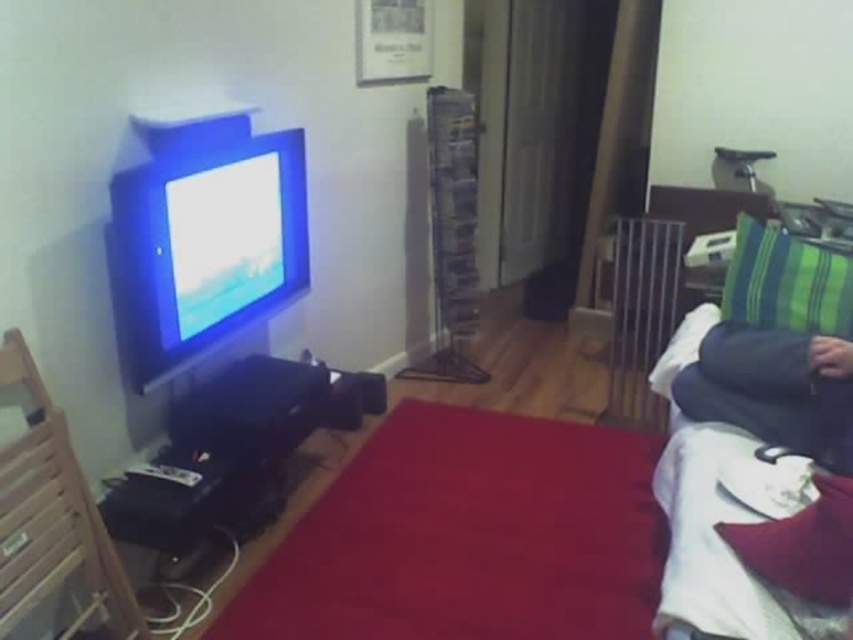
Does wooden armchair at left appear under green striped pillow at right?

Correct, wooden armchair at left is located below green striped pillow at right.

Where is `wooden armchair at left`? Image resolution: width=853 pixels, height=640 pixels. wooden armchair at left is located at coordinates (51, 515).

In order to click on wooden armchair at left in this screenshot , I will do `click(51, 515)`.

Can you confirm if wooden armchair at left is positioned above dark blue fabric at right?

Actually, wooden armchair at left is below dark blue fabric at right.

Between point (125, 632) and point (735, 364), which one is positioned behind?

The point (735, 364) is more distant.

Which is in front, point (13, 506) or point (773, 364)?

Point (13, 506)

Locate an element on the screen. Image resolution: width=853 pixels, height=640 pixels. wooden armchair at left is located at coordinates (51, 515).

Does point (741, 227) come closer to viewer compared to point (833, 586)?

No.

Does green striped pillow at right have a lesser width compared to velvet red pillow at lower right?

No, green striped pillow at right is not thinner than velvet red pillow at lower right.

Identify the location of green striped pillow at right. This screenshot has width=853, height=640. (786, 282).